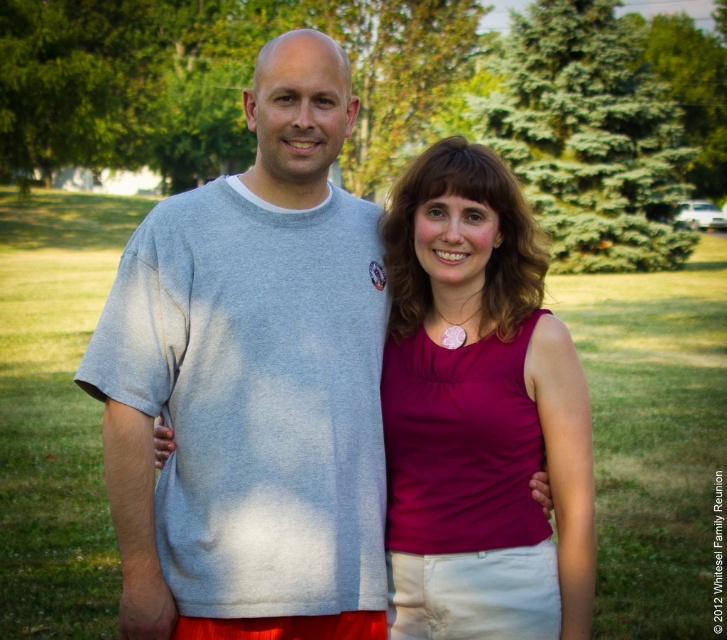
Question: Among these points, which one is farthest from the camera?

Choices:
 (A) (706, 518)
 (B) (550, 188)
 (C) (715, 104)

Answer: (C)

Question: Does matte pink fabric at center have a larger size compared to green leafy tree at upper right?

Choices:
 (A) no
 (B) yes

Answer: (A)

Question: Does matte pink fabric at center have a smaller size compared to green leafy tree at upper right?

Choices:
 (A) yes
 (B) no

Answer: (A)

Question: Which object is the closest to the gray heathered t-shirt at center?

Choices:
 (A) green leafy tree at upper right
 (B) green leafy tree at upper center
 (C) matte pink fabric at center
 (D) green grass at center

Answer: (C)

Question: Where is matte pink fabric at center located in relation to green leafy tree at upper center in the image?

Choices:
 (A) right
 (B) left

Answer: (B)

Question: Which of the following is the closest to the observer?

Choices:
 (A) green leafy tree at upper right
 (B) green leafy tree at upper center

Answer: (A)